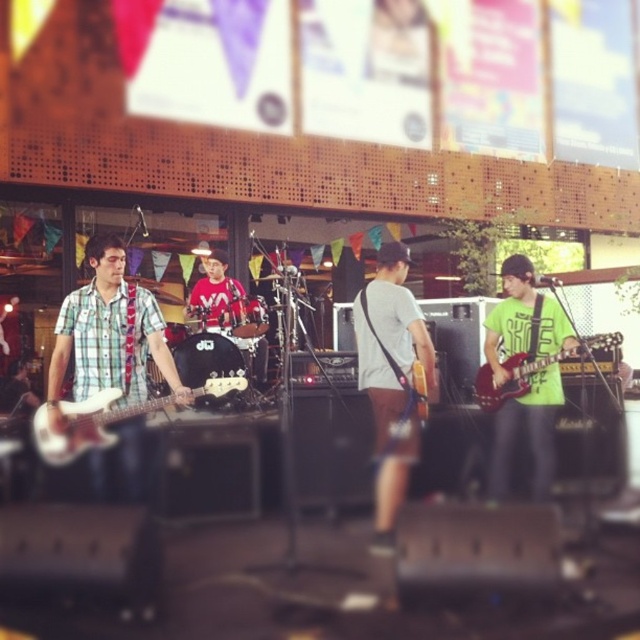
Who is positioned more to the left, green plaid shirt at left or white matte guitar at center?

From the viewer's perspective, green plaid shirt at left appears more on the left side.

The width and height of the screenshot is (640, 640). What do you see at coordinates (108, 333) in the screenshot?
I see `green plaid shirt at left` at bounding box center [108, 333].

Locate an element on the screen. The width and height of the screenshot is (640, 640). green plaid shirt at left is located at coordinates (108, 333).

Between glossy red electric guitar at center-right and matte red shirt at center, which one is positioned lower?

glossy red electric guitar at center-right is lower down.

Is glossy red electric guitar at center-right thinner than matte red shirt at center?

No, glossy red electric guitar at center-right is not thinner than matte red shirt at center.

Is point (493, 387) positioned in front of point (212, 330)?

Yes.

I want to click on glossy red electric guitar at center-right, so click(531, 369).

From the picture: Does white matte guitar at center appear under white matte bass guitar at left?

Incorrect, white matte guitar at center is not positioned below white matte bass guitar at left.

Who is lower down, white matte guitar at center or white matte bass guitar at left?

white matte bass guitar at left is lower down.

At what (x,y) coordinates should I click in order to perform the action: click on white matte guitar at center. Please return your answer as a coordinate pair (x, y). Looking at the image, I should click on (392, 380).